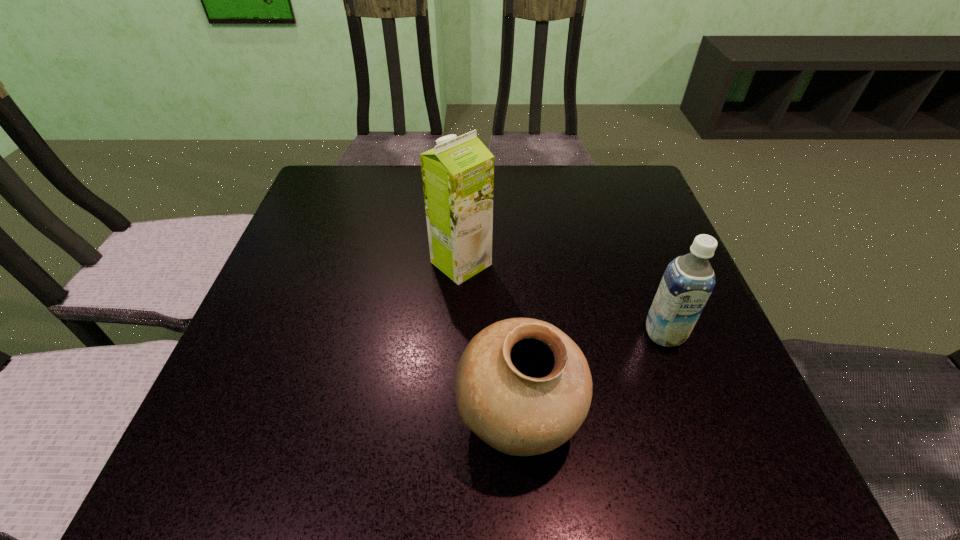
At what (x,y) coordinates should I click in order to perform the action: click on the farther soya milk. Please return your answer as a coordinate pair (x, y). The height and width of the screenshot is (540, 960). Looking at the image, I should click on (458, 174).

Image resolution: width=960 pixels, height=540 pixels. I want to click on the farthest object, so 458,174.

The height and width of the screenshot is (540, 960). What are the coordinates of `the rightmost object` in the screenshot? It's located at (688, 281).

Locate an element on the screen. the shorter soya milk is located at coordinates coord(688,281).

Image resolution: width=960 pixels, height=540 pixels. In order to click on the nearest object in this screenshot , I will do `click(524, 387)`.

What are the coordinates of `free space located 0.190m on the left of the farther soya milk` in the screenshot? It's located at coord(343,263).

At what (x,y) coordinates should I click in order to perform the action: click on vacant region located on the label of the shorter soya milk. Please return your answer as a coordinate pair (x, y). This screenshot has height=540, width=960. Looking at the image, I should click on (706, 446).

Locate an element on the screen. blank space located on the left of the nearest object is located at coordinates (248, 418).

You are a GUI agent. You are given a task and a screenshot of the screen. Output one action in this format:
    pyautogui.click(x=<x>, y=<y>)
    Task: Click on the object at the near edge
    The width and height of the screenshot is (960, 540).
    Given the screenshot: What is the action you would take?
    pyautogui.click(x=524, y=387)

Where is `object present at the right edge`? This screenshot has width=960, height=540. object present at the right edge is located at coordinates (688, 281).